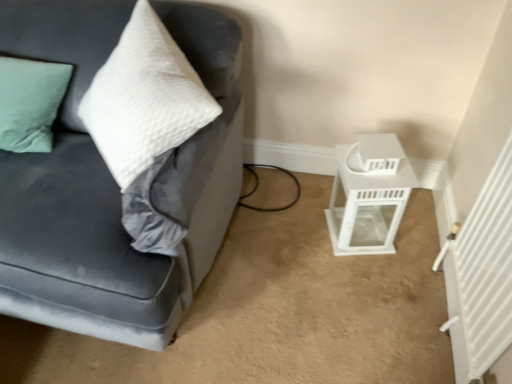
Where is `vacant space underneath white glossy lantern at lower right (from a real-world perspective)`? The image size is (512, 384). vacant space underneath white glossy lantern at lower right (from a real-world perspective) is located at coordinates [359, 228].